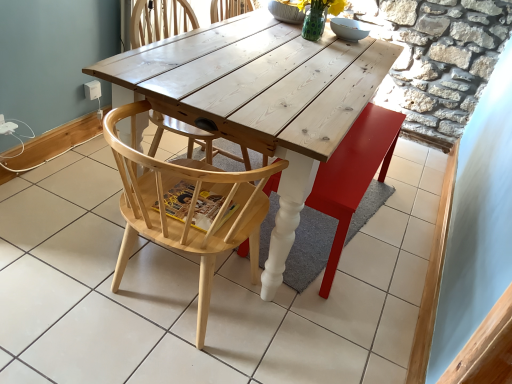
The height and width of the screenshot is (384, 512). I want to click on vacant region to the left of natural wood chair at center, the 1th chair viewed from the front, so click(63, 265).